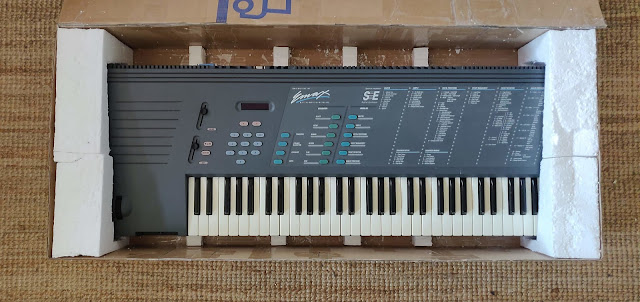
The image size is (640, 302). In order to click on knob in this screenshot , I will do `click(195, 144)`, `click(204, 114)`.